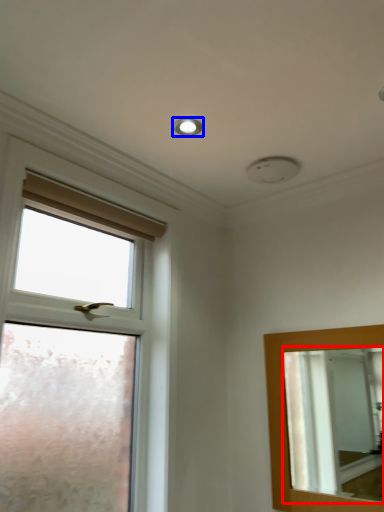
Question: Which object appears closest to the camera in this image, mirror (highlighted by a red box) or droplight (highlighted by a blue box)?

Choices:
 (A) mirror
 (B) droplight

Answer: (A)